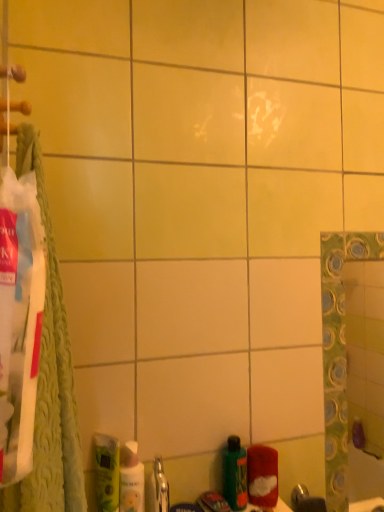
Question: Is the surface of red fuzzy cloth at lower right in direct contact with green matte mouthwash at lower left, the 2th mouthwash positioned from the right?

Choices:
 (A) no
 (B) yes

Answer: (A)

Question: Considering the relative positions of red fuzzy cloth at lower right and green matte mouthwash at lower left, the 2th mouthwash positioned from the right, in the image provided, is red fuzzy cloth at lower right to the right of green matte mouthwash at lower left, the 2th mouthwash positioned from the right, from the viewer's perspective?

Choices:
 (A) yes
 (B) no

Answer: (A)

Question: From the image's perspective, is red fuzzy cloth at lower right on top of green matte mouthwash at lower left, the 2th mouthwash positioned from the right?

Choices:
 (A) yes
 (B) no

Answer: (B)

Question: Can you confirm if red fuzzy cloth at lower right is wider than green matte mouthwash at lower left, the 2th mouthwash positioned from the right?

Choices:
 (A) no
 (B) yes

Answer: (B)

Question: Is red fuzzy cloth at lower right positioned with its back to green matte mouthwash at lower left, the 2th mouthwash positioned from the right?

Choices:
 (A) no
 (B) yes

Answer: (A)

Question: Considering the relative sizes of red fuzzy cloth at lower right and green matte mouthwash at lower left, the 2th mouthwash positioned from the right, in the image provided, is red fuzzy cloth at lower right taller than green matte mouthwash at lower left, the 2th mouthwash positioned from the right,?

Choices:
 (A) yes
 (B) no

Answer: (B)

Question: Is green textured towel at left smaller than white glossy mouthwash at lower left, which is the second mouthwash from left to right?

Choices:
 (A) no
 (B) yes

Answer: (A)

Question: From the image's perspective, would you say green textured towel at left is shown under white glossy mouthwash at lower left, which is the second mouthwash from left to right?

Choices:
 (A) no
 (B) yes

Answer: (A)

Question: From a real-world perspective, is green textured towel at left located beneath white glossy mouthwash at lower left, which ranks as the first mouthwash in right-to-left order?

Choices:
 (A) no
 (B) yes

Answer: (A)

Question: Is green textured towel at left to the right of white glossy mouthwash at lower left, which is the second mouthwash from left to right, from the viewer's perspective?

Choices:
 (A) yes
 (B) no

Answer: (B)

Question: Can you confirm if green textured towel at left is wider than white glossy mouthwash at lower left, which is the second mouthwash from left to right?

Choices:
 (A) no
 (B) yes

Answer: (B)

Question: Is green textured towel at left positioned behind white glossy mouthwash at lower left, which ranks as the first mouthwash in right-to-left order?

Choices:
 (A) yes
 (B) no

Answer: (B)

Question: Is green matte bottle at lower center to the left of white glossy mouthwash at lower left, which is the second mouthwash from left to right, from the viewer's perspective?

Choices:
 (A) no
 (B) yes

Answer: (A)